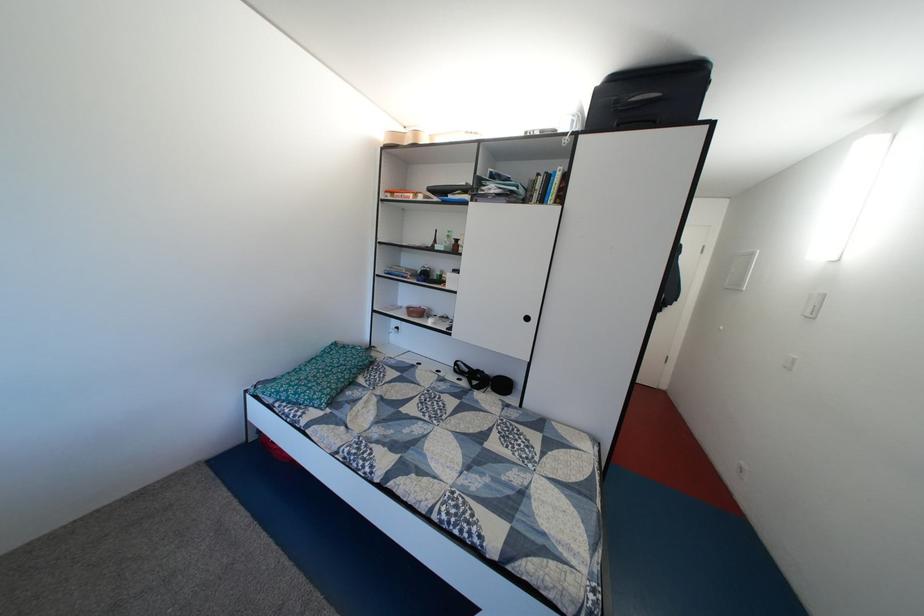
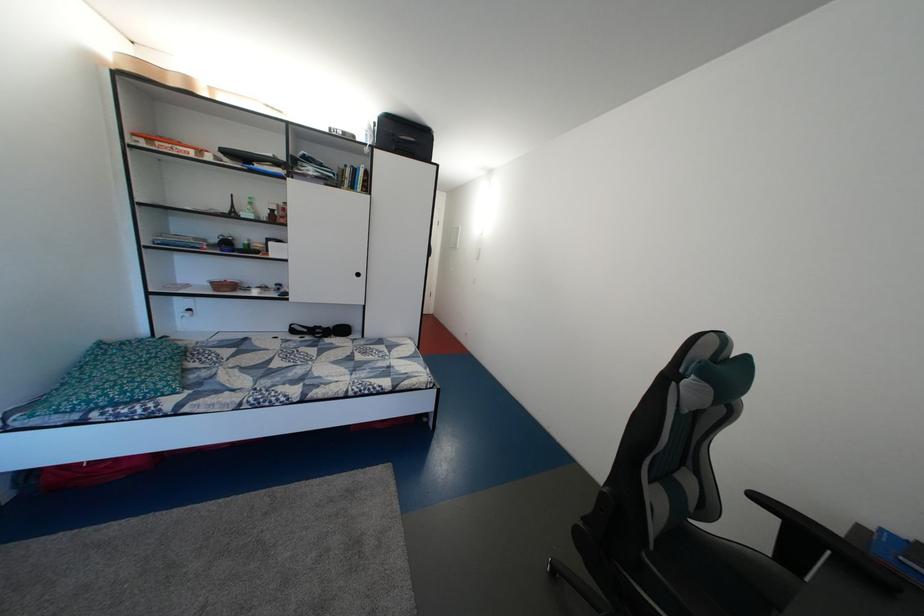
In the second image, find the point that corresponds to the point at 586,116 in the first image.

(378, 132)